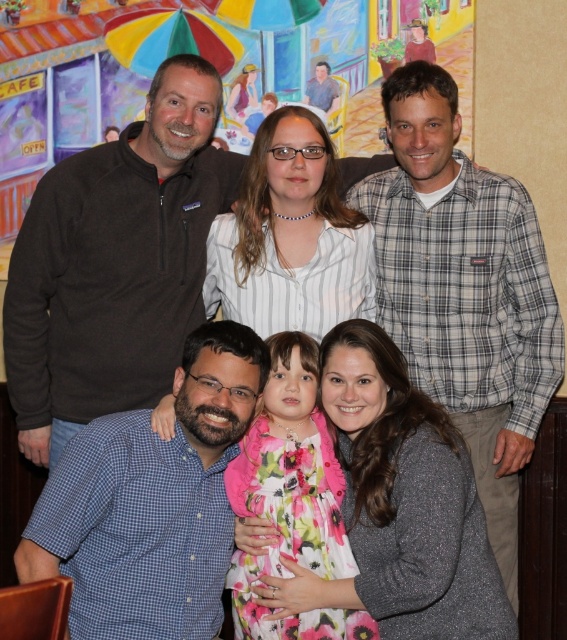
You are standing in front of the group photo and want to hand a gift to the person wearing the gray plaid shirt at upper right and the person wearing the floral fabric dress at center. Which person should you approach first based on their positions in the photo?

You should approach the gray plaid shirt at upper right first because it is closer to you than the floral fabric dress at center, as the gray plaid shirt at upper right is further to the viewer than the floral fabric dress at center.

You are a photographer standing 10 feet away from the dark brown fleece at upper left. Can you reach it without moving your position? Please explain.

The dark brown fleece at upper left is 8.35 feet from the viewer. Since you are standing 10 feet away, you cannot reach it without moving closer.

You are standing 2 meters away from the point at coordinates point (468, 332). If you want to move closer to it, how much closer can you get without exceeding the distance limit of 2.65 meters?

The point at coordinates point (468, 332) is currently 2.65 meters away from you. Since you are already at 2 meters away, you can move 0.65 meters closer to reach the minimum distance of 2.65 meters.